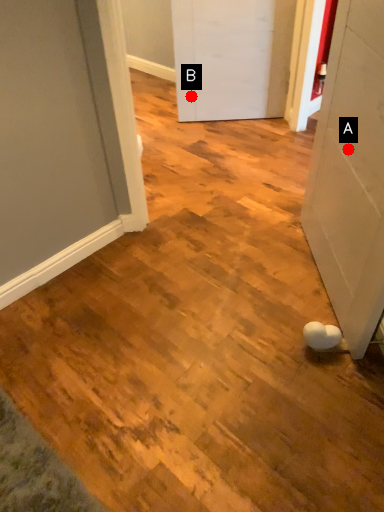
Question: Two points are circled on the image, labeled by A and B beside each circle. Among these points, which one is farthest from the camera?

Choices:
 (A) A is further
 (B) B is further

Answer: (B)